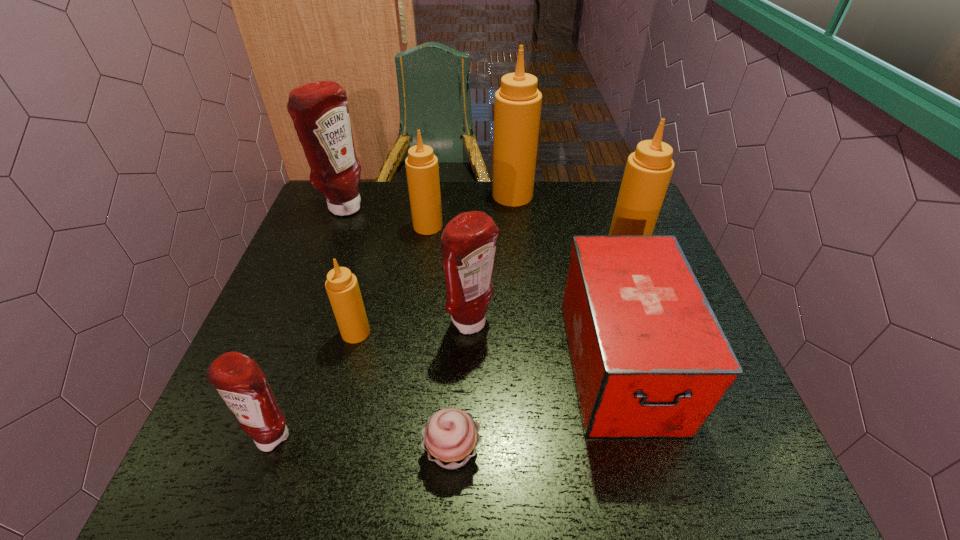
Identify which object is located as the fifth nearest to the farthest red condiment. Please provide its 2D coordinates. Your answer should be formatted as a tuple, i.e. [(x, y)], where the tuple contains the x and y coordinates of a point satisfying the conditions above.

[(241, 383)]

Locate an element on the screen. The height and width of the screenshot is (540, 960). object that is the second closest to the pink cupcake is located at coordinates (468, 244).

Locate which condiment is the sixth closest to the sixth object from right to left. Please provide its 2D coordinates. Your answer should be formatted as a tuple, i.e. [(x, y)], where the tuple contains the x and y coordinates of a point satisfying the conditions above.

[(241, 383)]

Identify which condiment is the sixth nearest to the first-aid kit. Please provide its 2D coordinates. Your answer should be formatted as a tuple, i.e. [(x, y)], where the tuple contains the x and y coordinates of a point satisfying the conditions above.

[(241, 383)]

Locate an element on the screen. tan condiment object that ranks as the fourth closest to the biggest red condiment is located at coordinates (648, 171).

Point out which tan condiment is positioned as the third nearest to the biggest red condiment. Please provide its 2D coordinates. Your answer should be formatted as a tuple, i.e. [(x, y)], where the tuple contains the x and y coordinates of a point satisfying the conditions above.

[(517, 109)]

Select which red condiment appears as the third closest to the sixth nearest object. Please provide its 2D coordinates. Your answer should be formatted as a tuple, i.e. [(x, y)], where the tuple contains the x and y coordinates of a point satisfying the conditions above.

[(241, 383)]

The width and height of the screenshot is (960, 540). Identify the location of red condiment that is the third closest to the third biggest tan condiment. (241, 383).

Locate an element on the screen. Image resolution: width=960 pixels, height=540 pixels. free region that satisfies the following two spatial constraints: 1. on the back side of the nearest red condiment; 2. on the right side of the sixth nearest object is located at coordinates (341, 248).

The width and height of the screenshot is (960, 540). Identify the location of vacant space that satisfies the following two spatial constraints: 1. on the front side of the second nearest red condiment; 2. on the left side of the third biggest tan condiment. (415, 324).